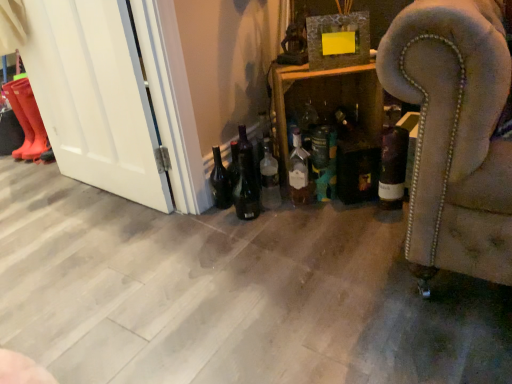
Where is `vacant space in front of white glossy door at left`? vacant space in front of white glossy door at left is located at coordinates (84, 229).